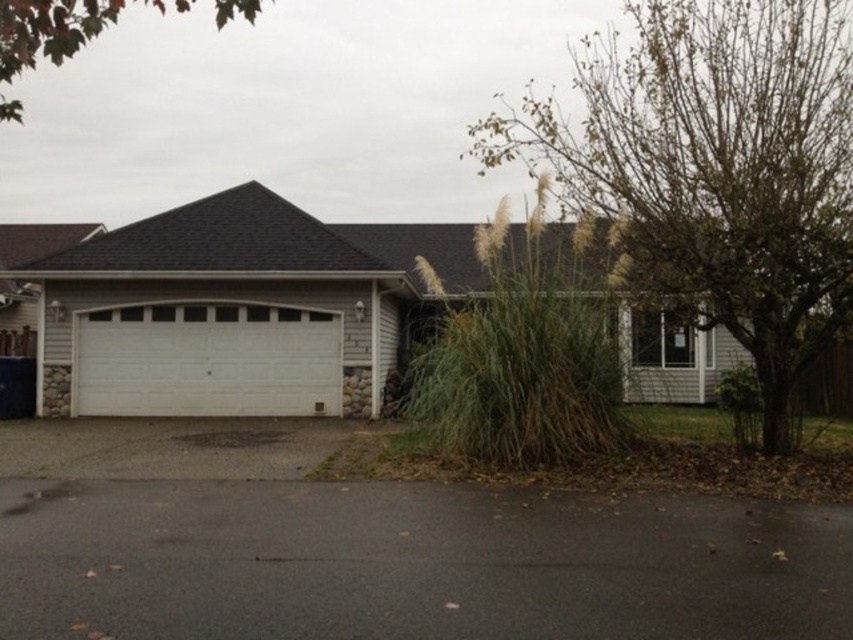
Describe the element at coordinates (714, 170) in the screenshot. I see `green grass at lower right` at that location.

Is green grass at lower right bigger than green leafy tree at upper left?

No.

Find the location of a particular element. green grass at lower right is located at coordinates (714, 170).

Does white painted wood garage door at center have a greater width compared to green leafy tree at upper left?

No.

Does point (135, 336) come in front of point (0, 60)?

No, it is behind (0, 60).

This screenshot has width=853, height=640. Describe the element at coordinates (206, 360) in the screenshot. I see `white painted wood garage door at center` at that location.

In order to click on white painted wood garage door at center in this screenshot , I will do `click(206, 360)`.

Does green grass at lower right appear under white painted wood garage door at center?

No.

Between point (709, 170) and point (318, 346), which one is positioned in front?

Point (709, 170) is more forward.

Locate an element on the screen. green grass at lower right is located at coordinates tap(714, 170).